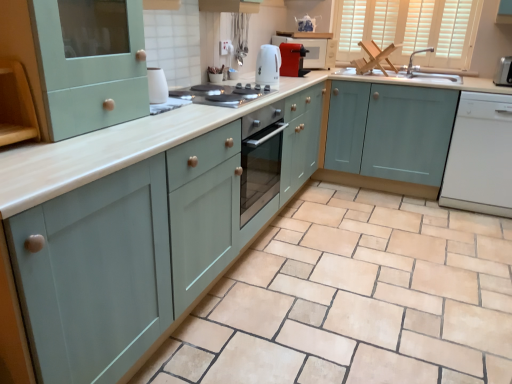
Locate an element on the screen. vacant area that is situated to the right of mint green wood cabinet at upper left, the third cabinetry positioned from the right is located at coordinates (159, 127).